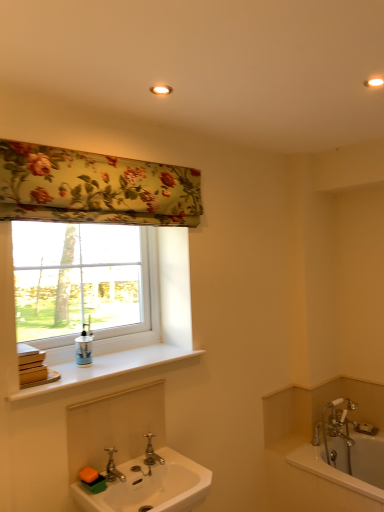
Question: Is white plastic window at upper left smaller than polished brass faucet at sink center, acting as the first tap starting from the right?

Choices:
 (A) yes
 (B) no

Answer: (B)

Question: Is white plastic window at upper left outside polished brass faucet at sink center, acting as the second tap starting from the front?

Choices:
 (A) yes
 (B) no

Answer: (A)

Question: Is polished brass faucet at sink center, acting as the second tap starting from the front, located within white plastic window at upper left?

Choices:
 (A) no
 (B) yes

Answer: (A)

Question: Is white plastic window at upper left to the right of polished brass faucet at sink center, placed as the 1th tap when sorted from back to front, from the viewer's perspective?

Choices:
 (A) yes
 (B) no

Answer: (B)

Question: From the image's perspective, would you say white plastic window at upper left is shown under polished brass faucet at sink center, acting as the second tap starting from the front?

Choices:
 (A) yes
 (B) no

Answer: (B)

Question: Does point (150, 435) appear closer or farther from the camera than point (150, 90)?

Choices:
 (A) farther
 (B) closer

Answer: (A)

Question: From a real-world perspective, is polished brass faucet at sink center, acting as the first tap starting from the right, above or below matte white recessed light at upper center?

Choices:
 (A) above
 (B) below

Answer: (B)

Question: Is polished brass faucet at sink center, acting as the first tap starting from the right, bigger or smaller than matte white recessed light at upper center?

Choices:
 (A) big
 (B) small

Answer: (A)

Question: Considering the relative positions of polished brass faucet at sink center, the 2th tap in the left-to-right sequence, and matte white recessed light at upper center in the image provided, is polished brass faucet at sink center, the 2th tap in the left-to-right sequence, to the left or to the right of matte white recessed light at upper center?

Choices:
 (A) right
 (B) left

Answer: (B)

Question: In terms of size, does matte white recessed light at upper center appear bigger or smaller than white glossy bathtub at lower right?

Choices:
 (A) big
 (B) small

Answer: (B)

Question: Would you say matte white recessed light at upper center is to the left or to the right of white glossy bathtub at lower right in the picture?

Choices:
 (A) right
 (B) left

Answer: (B)

Question: From a real-world perspective, is matte white recessed light at upper center positioned above or below white glossy bathtub at lower right?

Choices:
 (A) above
 (B) below

Answer: (A)

Question: In terms of width, does matte white recessed light at upper center look wider or thinner when compared to white glossy bathtub at lower right?

Choices:
 (A) wide
 (B) thin

Answer: (B)

Question: Is white matte window sill at upper left bigger or smaller than chrome metallic faucet at lower center, the 2th tap positioned from the right?

Choices:
 (A) small
 (B) big

Answer: (B)

Question: Does point (104, 369) appear closer or farther from the camera than point (105, 476)?

Choices:
 (A) farther
 (B) closer

Answer: (A)